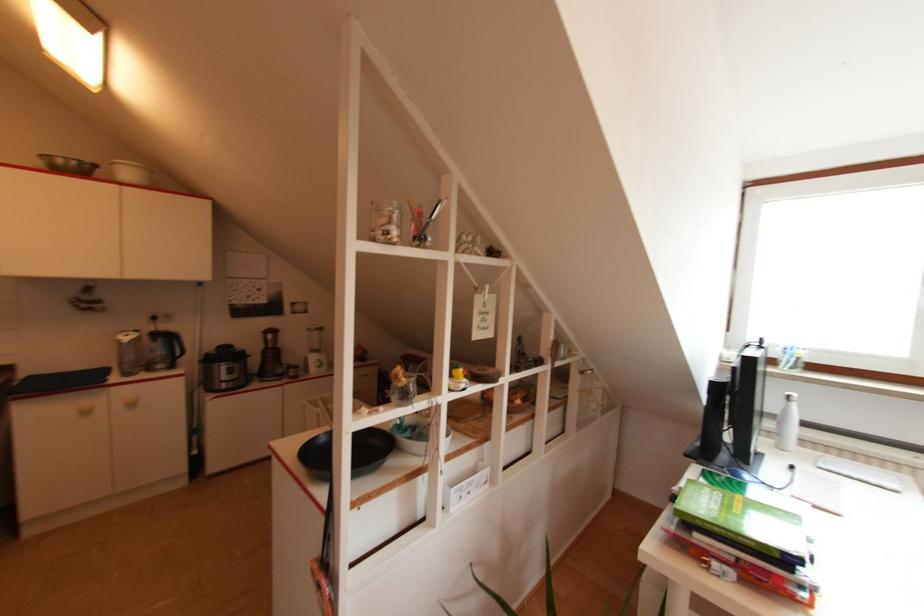
I want to click on kettle handle, so click(x=179, y=344).